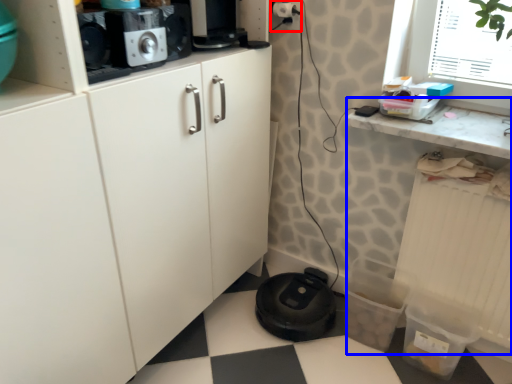
Question: Which of the following is the closest to the observer, electric outlet (highlighted by a red box) or counter (highlighted by a blue box)?

Choices:
 (A) electric outlet
 (B) counter

Answer: (B)